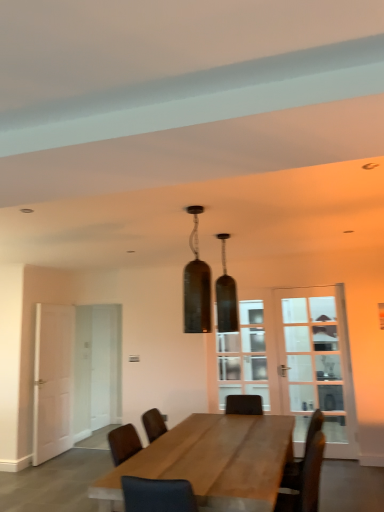
At what (x,y) coordinates should I click in order to perform the action: click on white matte door at left. Please return your answer as a coordinate pair (x, y). This screenshot has width=384, height=512. Looking at the image, I should click on (53, 381).

Measure the distance between point (206, 298) and camera.

Point (206, 298) is 9.57 feet from camera.

Identify the location of clear glass door at center. Image resolution: width=384 pixels, height=512 pixels. (244, 356).

From the image's perspective, is clear glass door at right, which is counted as the 1th glass door, starting from the front, on top of wooden table at center?

Yes.

Is clear glass door at right, positioned as the 2th glass door in back-to-front order, placed right next to wooden table at center?

clear glass door at right, positioned as the 2th glass door in back-to-front order, and wooden table at center are not in contact.

Considering the positions of point (345, 390) and point (207, 440), is point (345, 390) closer or farther from the camera than point (207, 440)?

Point (345, 390) is positioned farther from the camera compared to point (207, 440).

Which object is thinner, clear glass door at right, positioned as the 2th glass door in back-to-front order, or wooden table at center?

clear glass door at right, positioned as the 2th glass door in back-to-front order, is thinner.

Do you think clear glass door at center is within white matte door at left, or outside of it?

The correct answer is: outside.

Which is in front, point (219, 354) or point (69, 419)?

The point (69, 419) is in front.

Which object is more forward, clear glass door at center or white matte door at left?

white matte door at left is closer to the camera.

Image resolution: width=384 pixels, height=512 pixels. Find the location of `window above the white matte door at left (from the image's perspective)`. window above the white matte door at left (from the image's perspective) is located at coordinates (244, 356).

From the picture: Does white matte door at left turn towards white glass door at left, which appears as the 1th glass door when viewed from the back?

Yes.

Can you tell me how much white matte door at left and white glass door at left, which appears as the 1th glass door when viewed from the back, differ in facing direction?

The angular difference between white matte door at left and white glass door at left, which appears as the 1th glass door when viewed from the back, is 88.3 degrees.

Does white matte door at left have a larger size compared to white glass door at left, which appears as the first glass door when viewed from the left?

No.

Is white matte door at left situated inside white glass door at left, which is the 2th glass door from front to back, or outside?

white matte door at left is not inside white glass door at left, which is the 2th glass door from front to back, it's outside.

Where is `lamp that is the 2nd one when counting forward from the clear glass door at center`? lamp that is the 2nd one when counting forward from the clear glass door at center is located at coordinates point(196,285).

Which is in front, matte glass pendant light at center, the 2th lamp from the back, or clear glass door at center?

matte glass pendant light at center, the 2th lamp from the back, is closer to the camera.

Does matte glass pendant light at center, the 2th lamp from the back, have a larger size compared to clear glass door at center?

Actually, matte glass pendant light at center, the 2th lamp from the back, might be smaller than clear glass door at center.

How distant is matte glass pendant light at center, arranged as the first lamp when viewed from the front, from clear glass door at center?

The distance of matte glass pendant light at center, arranged as the first lamp when viewed from the front, from clear glass door at center is 3.02 meters.

Is white matte door at left to the right of clear glass door at center from the viewer's perspective?

In fact, white matte door at left is to the left of clear glass door at center.

Is white matte door at left wider or thinner than clear glass door at center?

white matte door at left is wider than clear glass door at center.

There is a white matte door at left. What are the coordinates of `window above it (from a real-world perspective)` in the screenshot? It's located at (244, 356).

Is matte glass pendant light at center, arranged as the first lamp when viewed from the front, aimed at matte glass pendant light at center, marked as the 1th lamp in a back-to-front arrangement?

No, matte glass pendant light at center, arranged as the first lamp when viewed from the front, is not turned towards matte glass pendant light at center, marked as the 1th lamp in a back-to-front arrangement.

Which point is more distant from viewer, (187, 306) or (219, 293)?

Point (219, 293)

Is matte glass pendant light at center, the 2th lamp from the back, smaller than matte glass pendant light at center, marked as the 1th lamp in a back-to-front arrangement?

Correct, matte glass pendant light at center, the 2th lamp from the back, occupies less space than matte glass pendant light at center, marked as the 1th lamp in a back-to-front arrangement.

How different are the orientations of matte glass pendant light at center, arranged as the first lamp when viewed from the front, and matte glass pendant light at center, marked as the 1th lamp in a back-to-front arrangement, in degrees?

The angular difference between matte glass pendant light at center, arranged as the first lamp when viewed from the front, and matte glass pendant light at center, marked as the 1th lamp in a back-to-front arrangement, is 0.000271 degrees.

Which object is positioned more to the right, white matte door at left or matte glass pendant light at center, arranged as the first lamp when viewed from the front?

From the viewer's perspective, matte glass pendant light at center, arranged as the first lamp when viewed from the front, appears more on the right side.

Starting from the white matte door at left, which lamp is the 2nd one in front? Please provide its 2D coordinates.

[(196, 285)]

Does white matte door at left have a larger size compared to matte glass pendant light at center, arranged as the first lamp when viewed from the front?

Correct, white matte door at left is larger in size than matte glass pendant light at center, arranged as the first lamp when viewed from the front.

Between white matte door at left and matte glass pendant light at center, the 2th lamp from the back, which one has less height?

matte glass pendant light at center, the 2th lamp from the back, is shorter.

You are a GUI agent. You are given a task and a screenshot of the screen. Output one action in this format:
    pyautogui.click(x=<x>, y=<y>)
    Task: Click on the glass door on the right of wooden table at center
    
    Given the screenshot: What is the action you would take?
    pyautogui.click(x=317, y=364)

The height and width of the screenshot is (512, 384). There is a white matte door at left. Find the location of `window above it (from a real-world perspective)`. window above it (from a real-world perspective) is located at coordinates (244, 356).

Based on their spatial positions, is matte glass pendant light at center, the 2th lamp in the front-to-back sequence, or wooden table at center further from clear glass door at center?

The object further to clear glass door at center is wooden table at center.

Based on their spatial positions, is clear glass door at right, the 1th glass door positioned from the right, or clear glass door at center further from white glass door at left, which appears as the 1th glass door when viewed from the back?

clear glass door at right, the 1th glass door positioned from the right.

Considering their positions, is wooden table at center positioned further to clear glass door at right, the 2th glass door positioned from the left, than clear glass door at center?

wooden table at center.

In the scene shown: Looking at the image, which one is located further to clear glass door at center, matte glass pendant light at center, marked as the 1th lamp in a back-to-front arrangement, or white matte door at left?

Based on the image, white matte door at left appears to be further to clear glass door at center.

From the image, which object appears to be nearer to white matte door at left, matte glass pendant light at center, marked as the 1th lamp in a back-to-front arrangement, or clear glass door at right, positioned as the 2th glass door in back-to-front order?

Based on the image, matte glass pendant light at center, marked as the 1th lamp in a back-to-front arrangement, appears to be nearer to white matte door at left.

Considering their positions, is clear glass door at center positioned closer to clear glass door at right, the 1th glass door positioned from the right, than white glass door at left, arranged as the 2th glass door when viewed from the right?

clear glass door at center.

When comparing their distances from clear glass door at center, does wooden table at center or white glass door at left, which appears as the first glass door when viewed from the left, seem closer?

Among the two, white glass door at left, which appears as the first glass door when viewed from the left, is located nearer to clear glass door at center.

Which object lies further to the anchor point clear glass door at right, the 1th glass door positioned from the right, white glass door at left, arranged as the 2th glass door when viewed from the right, or white matte door at left?

The object further to clear glass door at right, the 1th glass door positioned from the right, is white matte door at left.

This screenshot has width=384, height=512. Identify the location of lamp located between matte glass pendant light at center, the 2th lamp from the back, and clear glass door at center in the depth direction. (226, 296).

Locate an element on the screen. The image size is (384, 512). glass door between white matte door at left and clear glass door at right, the 1th glass door positioned from the right, from left to right is located at coordinates (97, 368).

Where is `lamp between matte glass pendant light at center, the 2th lamp from the back, and white matte door at left, along the z-axis`? lamp between matte glass pendant light at center, the 2th lamp from the back, and white matte door at left, along the z-axis is located at coordinates (226, 296).

This screenshot has height=512, width=384. I want to click on window located between white matte door at left and clear glass door at right, the 2th glass door positioned from the left, in the left-right direction, so click(x=244, y=356).